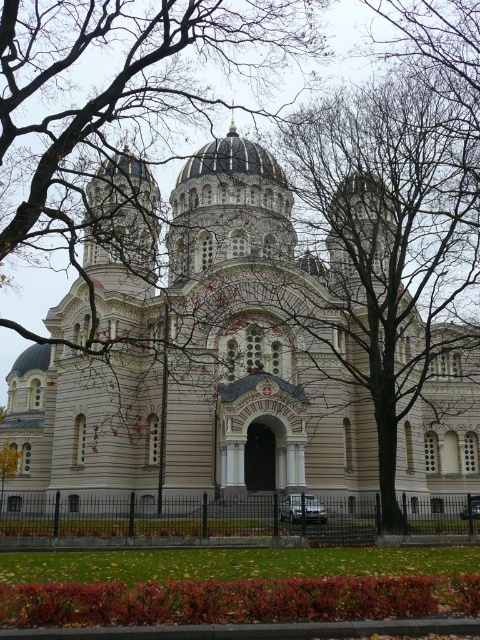
You are standing at the entrance of the cathedral and see two points marked in the image. The first point is at coordinate point (9, 435) and the second is at point (208, 113). Which point is closer to you?

Point (9, 435) is in front of point (208, 113), so it is closer to you.

You are a photographer planning to take a picture of the cathedral. You notice the bare branches at center and the gold domed roof at center. Which object will appear closer to the camera in the photo?

The bare branches at center will appear closer to the camera in the photo because they are positioned in front of the gold domed roof at center.